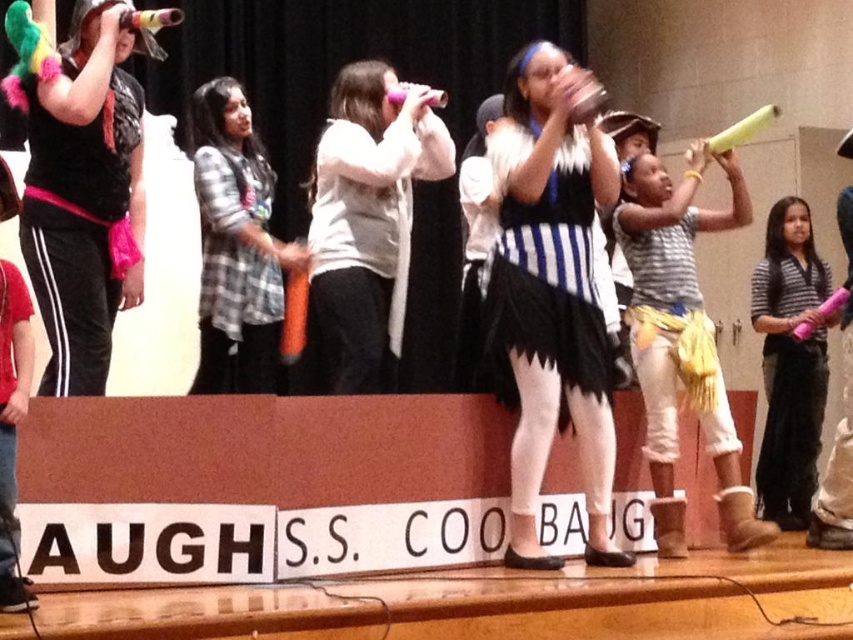
You are an audience member sitting in the front row of the stage. You notice two performers wearing a black and white striped skirt at center and a striped shirt at center. Which one is positioned to the left?

The black and white striped skirt at center is positioned to the left of the striped shirt at center.